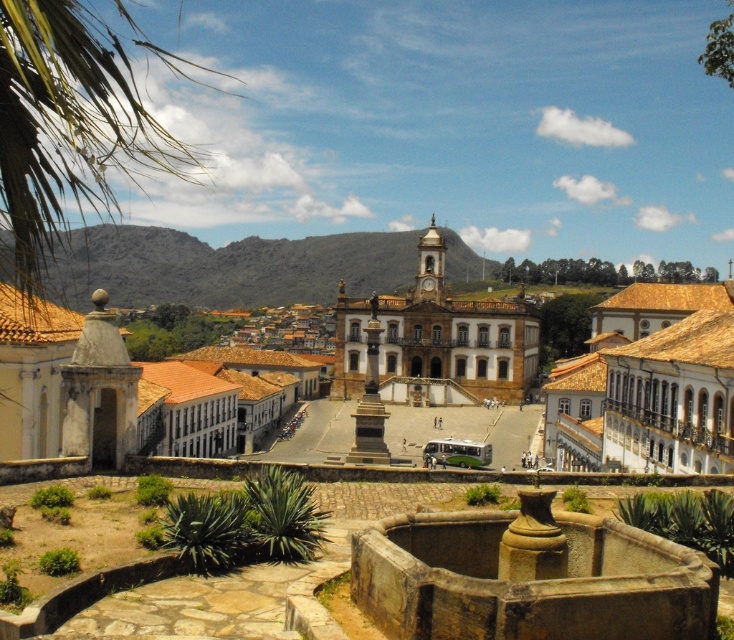
You are standing in the town square and want to take a photo of both the green leafy palm at upper left and the white stone town at center. Which object should you position closer to the camera to include both in the frame?

To include both the green leafy palm at upper left and the white stone town at center in the frame, position the green leafy palm at upper left closer to the camera since it is already nearer to the viewer than the white stone town at center.

You are a tourist standing in the town square and want to take a photo of the brown stone building at center. To avoid including the green leafy palm at upper left in your shot, which direction should you move?

The green leafy palm at upper left is to the left of the brown stone building at center. To avoid including it in your photo, you should move to the right side of the brown stone building at center.

You are an architect visiting the town square and want to take a photo of the green leafy palm at upper left and the brown stone building at center. Which object should you focus on first if you want to capture both in a single frame without moving the camera?

The green leafy palm at upper left is larger in size than the brown stone building at center, so you should focus on the green leafy palm at upper left first to ensure it fits properly in the frame.